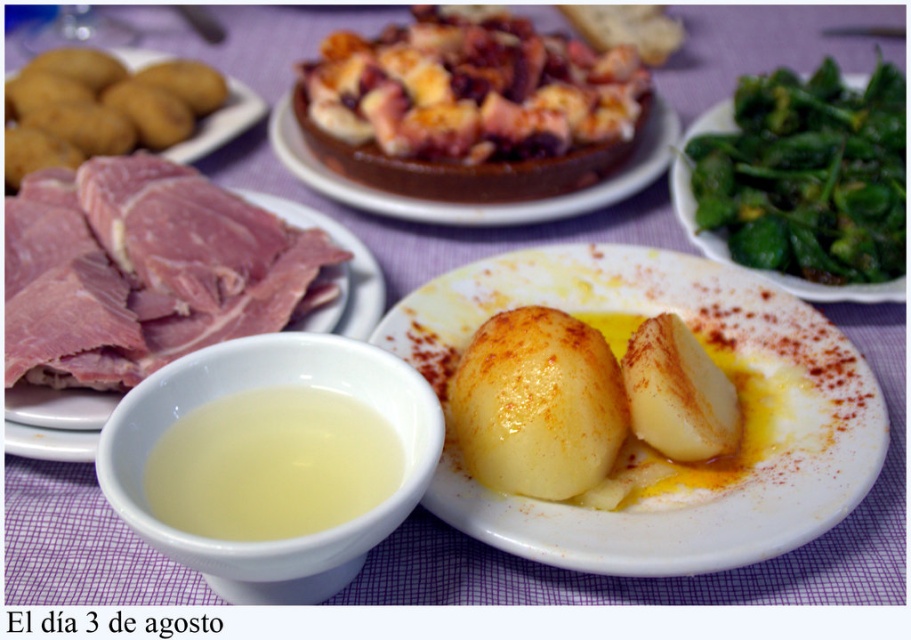
You are a guest at a dinner party and want to reach for the chocolate cake at center. However, there is a green smooth vegetable at upper right in your way. Can you move the vegetable to access the cake?

The green smooth vegetable at upper right is in front of the chocolate cake at center, so you can move the vegetable to access the cake.

Looking at the table setting with the green smooth vegetable at upper right and the chocolate cake at center, which item is positioned lower on the table?

The green smooth vegetable at upper right is located below the chocolate cake at center, so it is positioned lower on the table.